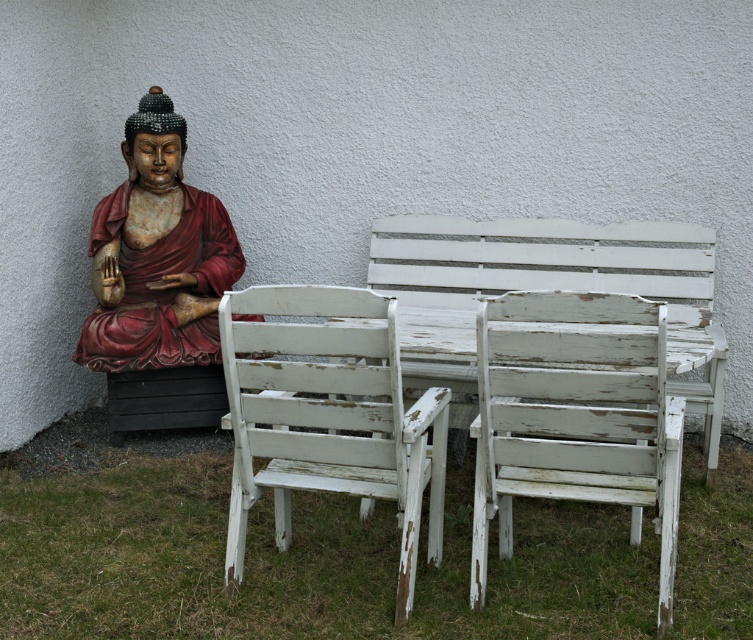
Is wooden statue at left below white chipped paint table at center?

Incorrect, wooden statue at left is not positioned below white chipped paint table at center.

The width and height of the screenshot is (753, 640). I want to click on wooden statue at left, so click(x=156, y=256).

Where is `wooden statue at left`? The width and height of the screenshot is (753, 640). wooden statue at left is located at coordinates (156, 256).

Does distressed white wood chair at center have a lesser width compared to white chipped paint table at center?

No.

Does distressed white wood chair at center have a lesser height compared to white chipped paint table at center?

No.

Is point (541, 305) closer to camera compared to point (721, 344)?

Yes, it is.

What are the coordinates of `distressed white wood chair at center` in the screenshot? It's located at (572, 413).

Which is more to the left, white chipped paint chair at center or wooden statue at left?

From the viewer's perspective, wooden statue at left appears more on the left side.

Locate an element on the screen. white chipped paint chair at center is located at coordinates (328, 417).